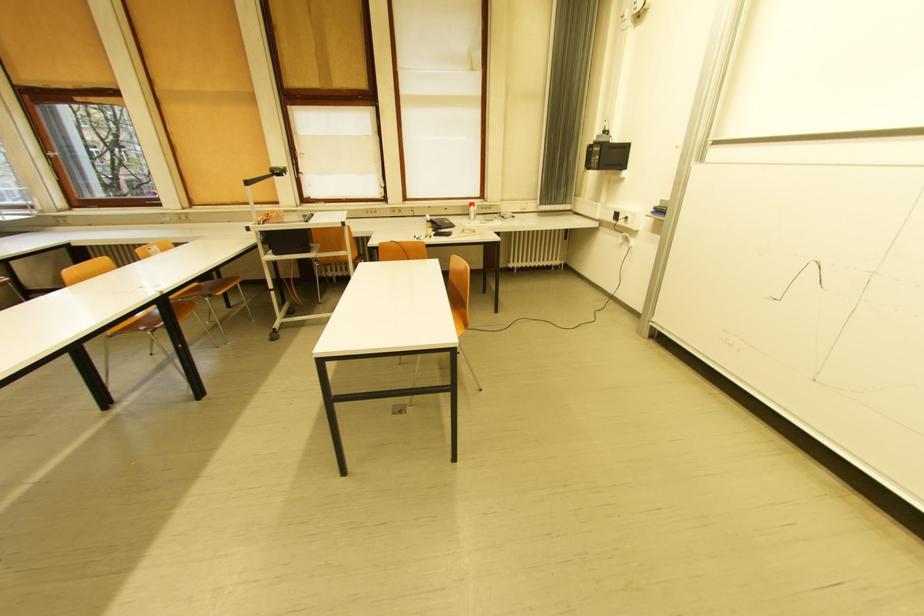
Find where to lift the telephone handset. Please return your answer as a coordinate pair (x, y).

(440, 224)